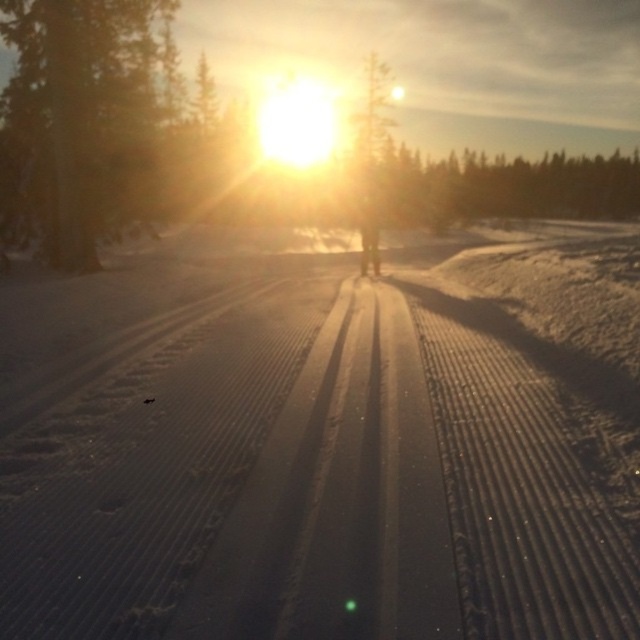
You are standing at the point closer to the camera in this winter scene. Which point are you at, point (241,548) or point (60,113)?

You are at point (241,548) because it is closer to the camera than point (60,113).

You are an artist sketching this winter scene. You want to ensure the white textured snow at center and the green textured tree at upper left are proportionally accurate. Which object should you draw larger in your sketch?

The green textured tree at upper left should be drawn larger because it occupies more space than the white textured snow at center.